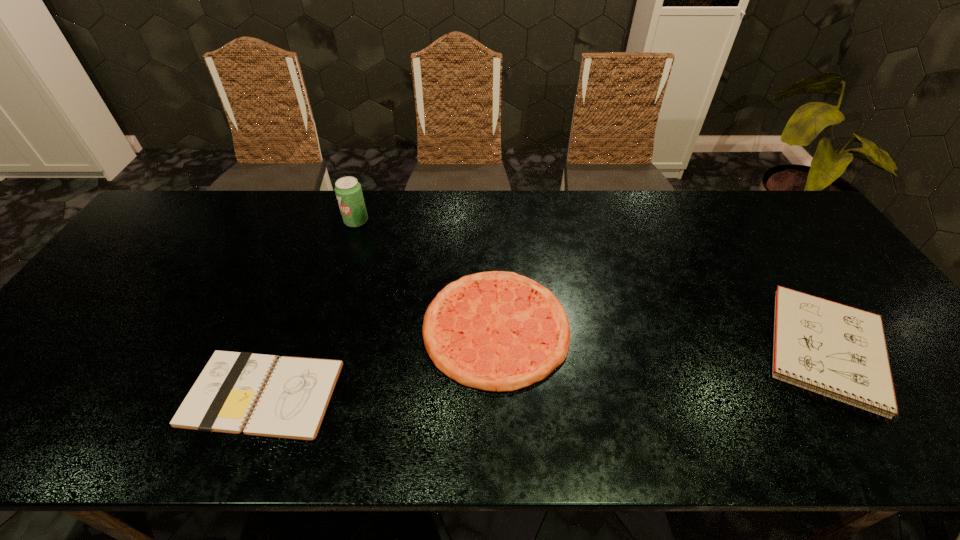
You are a GUI agent. You are given a task and a screenshot of the screen. Output one action in this format:
    pyautogui.click(x=<x>, y=<y>)
    Task: Click on the tallest object
    The height and width of the screenshot is (540, 960).
    Given the screenshot: What is the action you would take?
    pyautogui.click(x=348, y=190)

Locate an element on the screen. The image size is (960, 540). the farthest object is located at coordinates (348, 190).

In order to click on the rightmost object in this screenshot , I will do `click(835, 350)`.

The height and width of the screenshot is (540, 960). In order to click on the second tallest object in this screenshot , I will do `click(835, 350)`.

Locate an element on the screen. the third tallest object is located at coordinates (497, 330).

At what (x,y) coordinates should I click in order to perform the action: click on the second object from right to left. Please return your answer as a coordinate pair (x, y). Looking at the image, I should click on (497, 330).

At what (x,y) coordinates should I click in order to perform the action: click on the shortest object. Please return your answer as a coordinate pair (x, y). Image resolution: width=960 pixels, height=540 pixels. Looking at the image, I should click on (291, 394).

I want to click on the shorter notepad, so click(291, 394).

Where is `free spot located on the left of the tallest object`? free spot located on the left of the tallest object is located at coordinates (288, 221).

Locate an element on the screen. free region located 0.130m on the back of the right notepad is located at coordinates (766, 259).